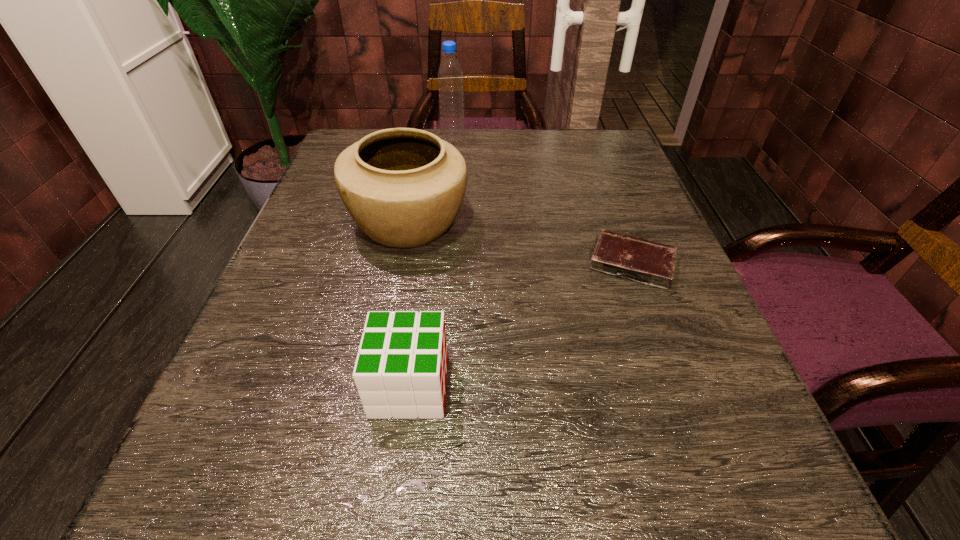
Locate which object ranks in proximity to the third shortest object. Please provide its 2D coordinates. Your answer should be formatted as a tuple, i.e. [(x, y)], where the tuple contains the x and y coordinates of a point satisfying the conditions above.

[(400, 371)]

Where is `vacant point that satisfies the following two spatial constraints: 1. on the front side of the water bottle; 2. on the red face of the third tallest object`? vacant point that satisfies the following two spatial constraints: 1. on the front side of the water bottle; 2. on the red face of the third tallest object is located at coordinates (430, 386).